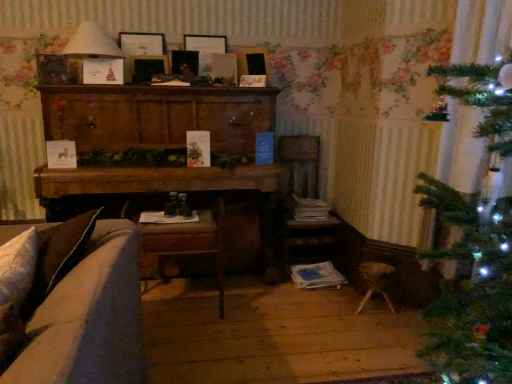
The image size is (512, 384). In order to click on vacant area that lies between woodenchair at lower center and wooden armchair at center in this screenshot , I will do `click(234, 292)`.